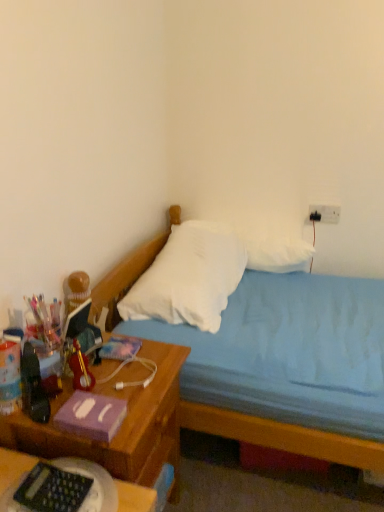
Question: Should I look upward or downward to see white soft pillow at center, the 1th pillow in the front-to-back sequence?

Choices:
 (A) down
 (B) up

Answer: (A)

Question: Is woodennightstand at left at the right side of white plastic electric outlet at upper right?

Choices:
 (A) no
 (B) yes

Answer: (A)

Question: From a real-world perspective, is woodennightstand at left on top of white plastic electric outlet at upper right?

Choices:
 (A) yes
 (B) no

Answer: (B)

Question: Considering the relative sizes of woodennightstand at left and white plastic electric outlet at upper right in the image provided, is woodennightstand at left smaller than white plastic electric outlet at upper right?

Choices:
 (A) yes
 (B) no

Answer: (B)

Question: Is woodennightstand at left thinner than white plastic electric outlet at upper right?

Choices:
 (A) no
 (B) yes

Answer: (A)

Question: Would you say white plastic electric outlet at upper right is part of woodennightstand at left's contents?

Choices:
 (A) no
 (B) yes

Answer: (A)

Question: Is woodennightstand at left touching white plastic electric outlet at upper right?

Choices:
 (A) no
 (B) yes

Answer: (A)

Question: Are white plastic electric outlet at upper right and blue fabric bed at center making contact?

Choices:
 (A) no
 (B) yes

Answer: (A)

Question: Is white plastic electric outlet at upper right taller than blue fabric bed at center?

Choices:
 (A) yes
 (B) no

Answer: (B)

Question: Is white plastic electric outlet at upper right facing towards blue fabric bed at center?

Choices:
 (A) no
 (B) yes

Answer: (B)

Question: Considering the relative sizes of white plastic electric outlet at upper right and blue fabric bed at center in the image provided, is white plastic electric outlet at upper right wider than blue fabric bed at center?

Choices:
 (A) yes
 (B) no

Answer: (B)

Question: Is white plastic electric outlet at upper right positioned beyond the bounds of blue fabric bed at center?

Choices:
 (A) no
 (B) yes

Answer: (B)

Question: From the image's perspective, is white plastic electric outlet at upper right located beneath blue fabric bed at center?

Choices:
 (A) yes
 (B) no

Answer: (B)

Question: Is the position of white soft pillow at center, the 1th pillow in the front-to-back sequence, more distant than that of white soft pillow at upper center, which appears as the 2th pillow when viewed from the front?

Choices:
 (A) yes
 (B) no

Answer: (B)